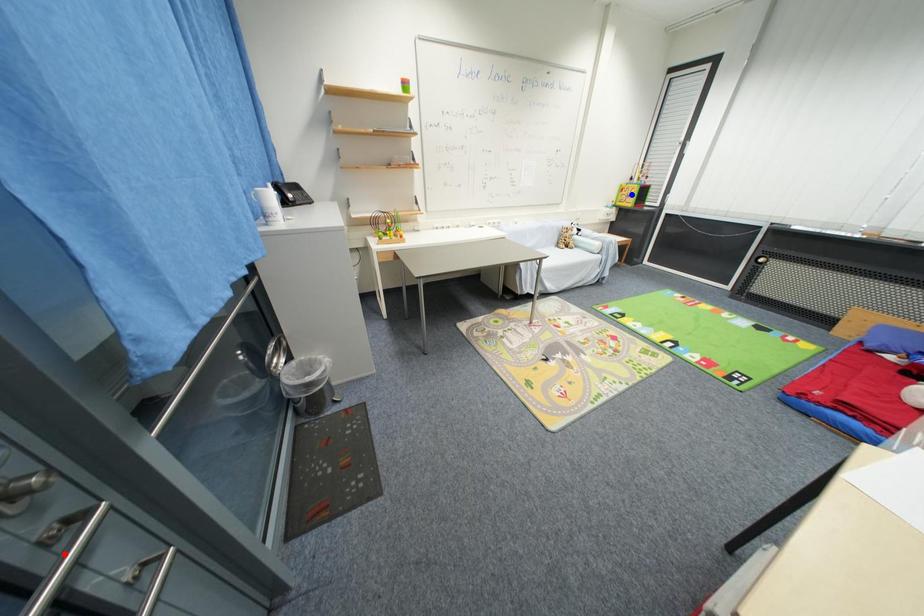
Question: Which of the two points in the image is closer to the camera?

Choices:
 (A) Blue point is closer.
 (B) Red point is closer.

Answer: (B)